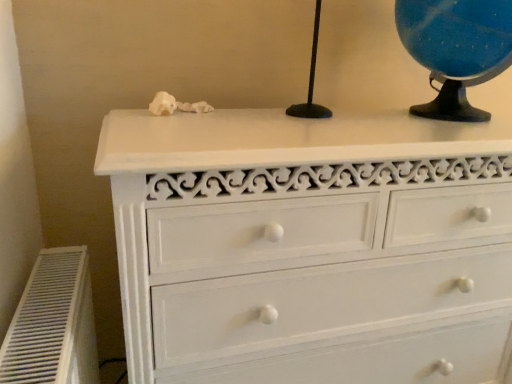
In order to face white plastic air conditioner at lower left, should I rotate leftwards or rightwards?

Rotate your view left by about 23.630°.

The image size is (512, 384). I want to click on white painted wood chest of drawers at upper center, so click(311, 247).

Identify the location of white plastic air conditioner at lower left. (53, 324).

Looking at this image, is matte black globe at upper right positioned far away from white plastic air conditioner at lower left?

They are positioned close to each other.

Does matte black globe at upper right lie in front of white plastic air conditioner at lower left?

No, it is not.

Can you confirm if matte black globe at upper right is thinner than white plastic air conditioner at lower left?

Incorrect, the width of matte black globe at upper right is not less than that of white plastic air conditioner at lower left.

Can you confirm if white painted wood chest of drawers at upper center is positioned to the right of white plastic air conditioner at lower left?

Yes, white painted wood chest of drawers at upper center is to the right of white plastic air conditioner at lower left.

From a real-world perspective, is white painted wood chest of drawers at upper center positioned under white plastic air conditioner at lower left based on gravity?

No, from a real-world perspective, white painted wood chest of drawers at upper center is not under white plastic air conditioner at lower left.

Where is `chest of drawers above the white plastic air conditioner at lower left (from the image's perspective)`? chest of drawers above the white plastic air conditioner at lower left (from the image's perspective) is located at coordinates (311, 247).

From the image's perspective, between white painted wood chest of drawers at upper center and white plastic air conditioner at lower left, who is located below?

white plastic air conditioner at lower left.

Considering the relative sizes of white plastic air conditioner at lower left and matte black globe at upper right in the image provided, is white plastic air conditioner at lower left smaller than matte black globe at upper right?

No, white plastic air conditioner at lower left is not smaller than matte black globe at upper right.

Is white plastic air conditioner at lower left placed right next to matte black globe at upper right?

No, white plastic air conditioner at lower left is not with matte black globe at upper right.

From the image's perspective, does white plastic air conditioner at lower left appear higher than matte black globe at upper right?

Actually, white plastic air conditioner at lower left appears below matte black globe at upper right in the image.

Is point (80, 249) closer or farther from the camera than point (481, 40)?

Point (80, 249).

Is point (153, 207) farther from camera compared to point (493, 44)?

No, (153, 207) is closer to viewer.

Is white painted wood chest of drawers at upper center not inside matte black globe at upper right?

That's correct, white painted wood chest of drawers at upper center is outside of matte black globe at upper right.

Identify the location of chest of drawers below the matte black globe at upper right (from the image's perspective). (311, 247).

Considering the relative sizes of white plastic air conditioner at lower left and white painted wood chest of drawers at upper center in the image provided, is white plastic air conditioner at lower left shorter than white painted wood chest of drawers at upper center?

Yes.

Which is nearer, (58, 368) or (319, 203)?

Clearly, point (58, 368) is closer to the camera than point (319, 203).

From a real-world perspective, is white plastic air conditioner at lower left beneath white painted wood chest of drawers at upper center?

Yes.

Where is `chest of drawers located on the right of white plastic air conditioner at lower left`? This screenshot has width=512, height=384. chest of drawers located on the right of white plastic air conditioner at lower left is located at coordinates (311, 247).

Consider the image. Is matte black globe at upper right aimed at white painted wood chest of drawers at upper center?

No, matte black globe at upper right is not aimed at white painted wood chest of drawers at upper center.

From the image's perspective, is matte black globe at upper right below white painted wood chest of drawers at upper center?

Actually, matte black globe at upper right appears above white painted wood chest of drawers at upper center in the image.

Looking at their sizes, would you say matte black globe at upper right is wider or thinner than white painted wood chest of drawers at upper center?

Considering their sizes, matte black globe at upper right looks slimmer than white painted wood chest of drawers at upper center.

The height and width of the screenshot is (384, 512). What are the coordinates of `the chest of drawers below the matte black globe at upper right (from the image's perspective)` in the screenshot? It's located at (311, 247).

The image size is (512, 384). Find the location of `table lamp above the white plastic air conditioner at lower left (from a real-world perspective)`. table lamp above the white plastic air conditioner at lower left (from a real-world perspective) is located at coordinates (456, 49).

Where is `chest of drawers behind the white plastic air conditioner at lower left`? Image resolution: width=512 pixels, height=384 pixels. chest of drawers behind the white plastic air conditioner at lower left is located at coordinates (311, 247).

When comparing their distances from white plastic air conditioner at lower left, does matte black globe at upper right or white painted wood chest of drawers at upper center seem further?

Based on the image, matte black globe at upper right appears to be further to white plastic air conditioner at lower left.

Based on their spatial positions, is white painted wood chest of drawers at upper center or matte black globe at upper right closer to white plastic air conditioner at lower left?

Among the two, white painted wood chest of drawers at upper center is located nearer to white plastic air conditioner at lower left.

Based on their spatial positions, is white plastic air conditioner at lower left or white painted wood chest of drawers at upper center further from matte black globe at upper right?

white plastic air conditioner at lower left.

Considering their positions, is white painted wood chest of drawers at upper center positioned closer to matte black globe at upper right than white plastic air conditioner at lower left?

white painted wood chest of drawers at upper center.

Considering their positions, is white plastic air conditioner at lower left positioned further to white painted wood chest of drawers at upper center than matte black globe at upper right?

white plastic air conditioner at lower left.

Estimate the real-world distances between objects in this image. Which object is closer to white painted wood chest of drawers at upper center, matte black globe at upper right or white plastic air conditioner at lower left?

matte black globe at upper right is closer to white painted wood chest of drawers at upper center.

You are a GUI agent. You are given a task and a screenshot of the screen. Output one action in this format:
    pyautogui.click(x=<x>, y=<y>)
    Task: Click on the chest of drawers between white plastic air conditioner at lower left and matte black globe at upper right from left to right
    The image size is (512, 384).
    Given the screenshot: What is the action you would take?
    pyautogui.click(x=311, y=247)